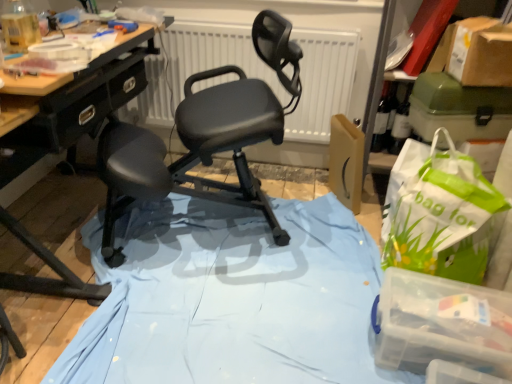
Where is `white matte radiator at center`? The image size is (512, 384). white matte radiator at center is located at coordinates (322, 82).

What do you see at coordinates (459, 109) in the screenshot? Image resolution: width=512 pixels, height=384 pixels. I see `green plastic box at upper right, which is the second box in front-to-back order` at bounding box center [459, 109].

Where is `white matte radiator at center`? This screenshot has height=384, width=512. white matte radiator at center is located at coordinates coord(322,82).

Which object is closer to the camera, matte black chair at center or transparent plastic container at lower right, acting as the first box starting from the front?

matte black chair at center is in front.

Is matte black chair at center oriented towards transparent plastic container at lower right, the first box ordered from the bottom?

No, matte black chair at center is not oriented towards transparent plastic container at lower right, the first box ordered from the bottom.

Is there a large distance between matte black chair at center and transparent plastic container at lower right, arranged as the second box when viewed from the back?

That's not correct — matte black chair at center is a little close to transparent plastic container at lower right, arranged as the second box when viewed from the back.

Does matte black chair at center contain transparent plastic container at lower right, acting as the first box starting from the front?

No, transparent plastic container at lower right, acting as the first box starting from the front, is located outside of matte black chair at center.

Could you tell me if matte glass bottle at upper right is facing white matte radiator at center?

No, matte glass bottle at upper right is not facing towards white matte radiator at center.

Does matte glass bottle at upper right have a greater height compared to white matte radiator at center?

In fact, matte glass bottle at upper right may be shorter than white matte radiator at center.

Where is `bottle that appears in front of the white matte radiator at center`? This screenshot has width=512, height=384. bottle that appears in front of the white matte radiator at center is located at coordinates (401, 124).

Is point (396, 120) positioned after point (173, 48)?

No, it is in front of (173, 48).

Does light blue fabric at center have a lesser width compared to matte black chair at center?

No.

In terms of size, does light blue fabric at center appear bigger or smaller than matte black chair at center?

Considering their sizes, light blue fabric at center takes up less space than matte black chair at center.

Does point (330, 195) appear closer or farther from the camera than point (222, 69)?

Point (330, 195) appears to be farther away from the viewer than point (222, 69).

Is matte black chair at center in contact with green plastic box at upper right, which is the first box from top to bottom?

matte black chair at center and green plastic box at upper right, which is the first box from top to bottom, are not in contact.

Considering the relative positions of matte black chair at center and green plastic box at upper right, which is the first box from top to bottom, in the image provided, is matte black chair at center to the left or to the right of green plastic box at upper right, which is the first box from top to bottom,?

Clearly, matte black chair at center is on the left of green plastic box at upper right, which is the first box from top to bottom, in the image.

Does matte black chair at center have a smaller size compared to green plastic box at upper right, which is the first box from top to bottom?

Actually, matte black chair at center might be larger than green plastic box at upper right, which is the first box from top to bottom.

How distant is matte black chair at center from green plastic box at upper right, which is the first box in back-to-front order?

matte black chair at center and green plastic box at upper right, which is the first box in back-to-front order, are 26.62 inches apart from each other.

Based on the photo, is white matte radiator at center not near green plastic box at upper right, which is the first box from top to bottom?

They are positioned close to each other.

The image size is (512, 384). Find the location of `box above the white matte radiator at center (from a real-world perspective)`. box above the white matte radiator at center (from a real-world perspective) is located at coordinates (459, 109).

Between white matte radiator at center and green plastic box at upper right, which is the first box in back-to-front order, which one has smaller size?

Smaller between the two is green plastic box at upper right, which is the first box in back-to-front order.

From the picture: How different are the orientations of white matte radiator at center and green plastic box at upper right, which is the second box in front-to-back order, in degrees?

There is a 77.9-degree angle between the facing directions of white matte radiator at center and green plastic box at upper right, which is the second box in front-to-back order.

From the image's perspective, which is below, brown cardboard box at upper right or light blue fabric at center?

light blue fabric at center, from the image's perspective.

Is brown cardboard box at upper right further to camera compared to light blue fabric at center?

→ Yes, brown cardboard box at upper right is further from the camera.

Where is `cardboard box located on the right of light blue fabric at center`? Image resolution: width=512 pixels, height=384 pixels. cardboard box located on the right of light blue fabric at center is located at coordinates (476, 52).

Is brown cardboard box at upper right bigger or smaller than transparent plastic container at lower right, which is counted as the 2th box, starting from the top?

brown cardboard box at upper right is bigger than transparent plastic container at lower right, which is counted as the 2th box, starting from the top.

Is transparent plastic container at lower right, the first box ordered from the bottom, surrounded by brown cardboard box at upper right?

Actually, transparent plastic container at lower right, the first box ordered from the bottom, is outside brown cardboard box at upper right.

Based on the photo, how different are the orientations of brown cardboard box at upper right and transparent plastic container at lower right, which is counted as the 2th box, starting from the top, in degrees?

brown cardboard box at upper right and transparent plastic container at lower right, which is counted as the 2th box, starting from the top, are facing 75 degrees away from each other.

Is brown cardboard box at upper right directly adjacent to transparent plastic container at lower right, the first box ordered from the bottom?

They are not placed beside each other.

The width and height of the screenshot is (512, 384). I want to click on box that is the 1st object to the right of the matte black chair at center, starting at the anchor, so click(442, 324).

Where is `radiator behind the matte glass bottle at upper right`? This screenshot has width=512, height=384. radiator behind the matte glass bottle at upper right is located at coordinates (322, 82).

Based on the photo, considering their positions, is light blue fabric at center positioned closer to matte black chair at center than green plastic box at upper right, which is the first box in back-to-front order?

light blue fabric at center lies closer to matte black chair at center than the other object.

When comparing their distances from green plastic box at upper right, which is the first box in back-to-front order, does transparent plastic container at lower right, arranged as the second box when viewed from the back, or matte black chair at center seem further?

The object further to green plastic box at upper right, which is the first box in back-to-front order, is matte black chair at center.

When comparing their distances from light blue fabric at center, does green plastic box at upper right, which is the first box from top to bottom, or white matte radiator at center seem further?

Among the two, white matte radiator at center is located further to light blue fabric at center.

Which object lies further to the anchor point brown cardboard box at upper right, matte black chair at center or green plastic box at upper right, which is the first box from top to bottom?

matte black chair at center.

When comparing their distances from light blue fabric at center, does transparent plastic container at lower right, arranged as the second box when viewed from the back, or green plastic box at upper right, which is the second box in front-to-back order, seem further?

Based on the image, green plastic box at upper right, which is the second box in front-to-back order, appears to be further to light blue fabric at center.

From the image, which object appears to be farther from green plastic box at upper right, which is the second box in front-to-back order, brown cardboard box at upper right or matte black chair at center?

The object further to green plastic box at upper right, which is the second box in front-to-back order, is matte black chair at center.

From the image, which object appears to be farther from matte glass bottle at upper right, green plastic box at upper right, which is the first box from top to bottom, or matte black chair at center?

matte black chair at center.

Based on their spatial positions, is transparent plastic container at lower right, the first box ordered from the bottom, or matte black chair at center closer to brown cardboard box at upper right?

matte black chair at center lies closer to brown cardboard box at upper right than the other object.

The width and height of the screenshot is (512, 384). What are the coordinates of `sheet located between matte black chair at center and green plastic box at upper right, which is the first box from top to bottom, in the left-right direction` in the screenshot? It's located at (232, 299).

Locate an element on the screen. This screenshot has height=384, width=512. bottle located between matte black chair at center and green plastic box at upper right, which is the first box in back-to-front order, in the left-right direction is located at coordinates (401, 124).

I want to click on radiator between light blue fabric at center and green plastic box at upper right, the 2th box in the bottom-to-top sequence, so click(322, 82).

This screenshot has width=512, height=384. In order to click on radiator between light blue fabric at center and brown cardboard box at upper right from left to right in this screenshot , I will do pyautogui.click(x=322, y=82).